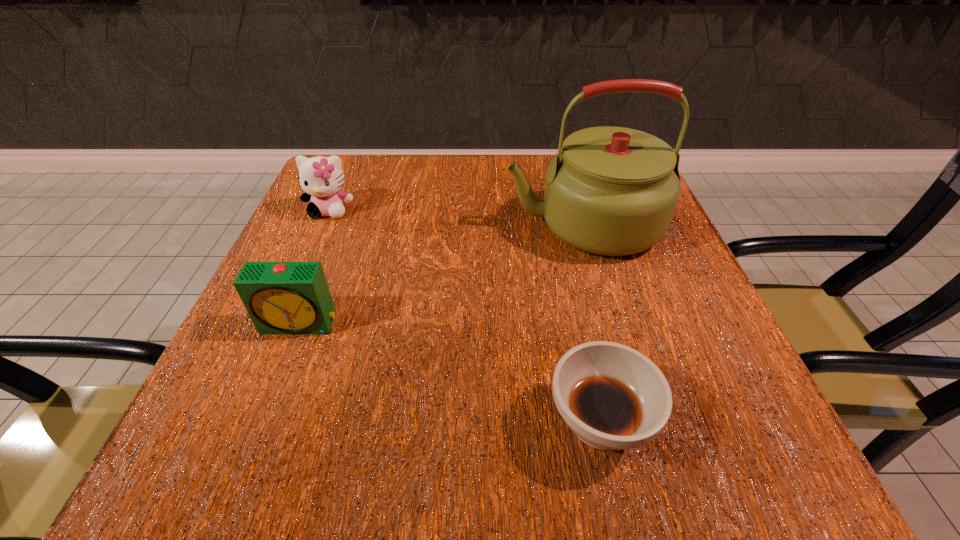
This screenshot has height=540, width=960. What are the coordinates of `the tallest object` in the screenshot? It's located at coord(612,191).

You are a GUI agent. You are given a task and a screenshot of the screen. Output one action in this format:
    pyautogui.click(x=<x>, y=<y>)
    Task: Click on the kitten
    The image size is (960, 540).
    Given the screenshot: What is the action you would take?
    pyautogui.click(x=321, y=178)

Identify the location of alarm clock. (280, 297).

The image size is (960, 540). Find the location of `soup bowl`. soup bowl is located at coordinates (613, 397).

You are a GUI agent. You are given a task and a screenshot of the screen. Output one action in this format:
    pyautogui.click(x=<x>, y=<y>)
    Task: Click on the nearest object
    This screenshot has width=960, height=540.
    Given the screenshot: What is the action you would take?
    613,397

Locate an element on the screen. This screenshot has height=540, width=960. vacant space located 0.340m at the spout of the tallest object is located at coordinates (332, 224).

This screenshot has width=960, height=540. In order to click on vacant space located 0.070m at the spout of the tallest object in this screenshot , I will do `click(468, 224)`.

The width and height of the screenshot is (960, 540). In order to click on free region located 0.310m at the spout of the tallest object in this screenshot , I will do `click(347, 224)`.

Where is `free location located on the front-facing side of the kitten`? free location located on the front-facing side of the kitten is located at coordinates (269, 352).

Locate an element on the screen. This screenshot has width=960, height=540. vacant point located on the front-facing side of the second nearest object is located at coordinates (277, 381).